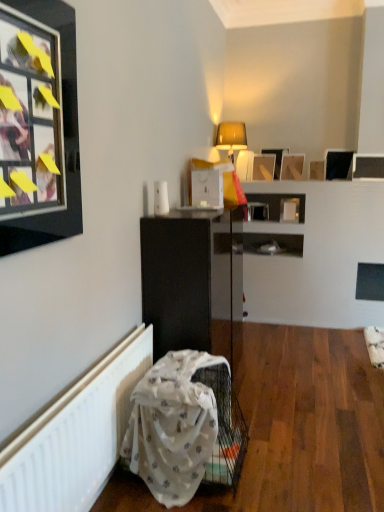
Image resolution: width=384 pixels, height=512 pixels. Identify the location of spots to the right of white fabric swivel chair at lower left. pos(284,458).